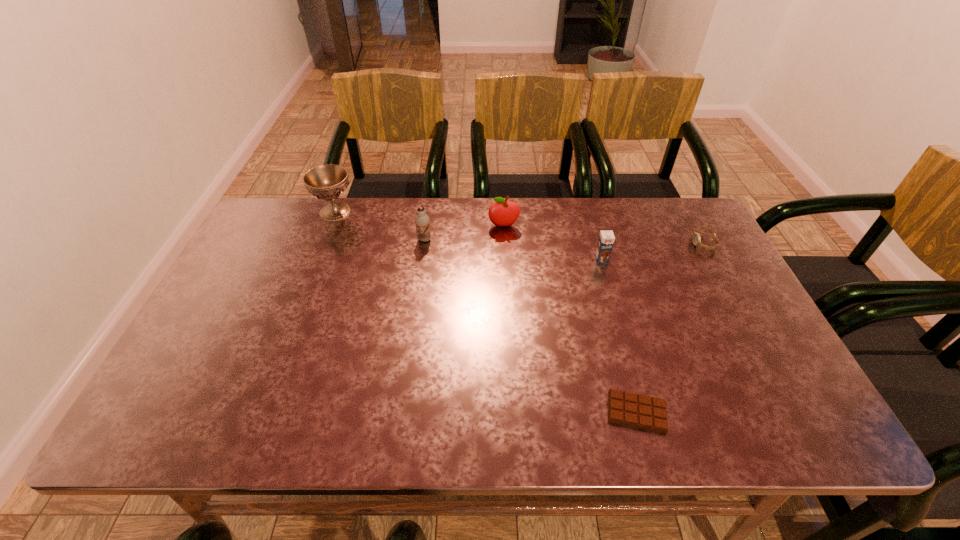
In order to click on chalice in this screenshot , I will do pos(327,182).

Locate an element on the screen. The image size is (960, 540). the fifth object from right to left is located at coordinates (422, 221).

What are the coordinates of `the farther chocolate milk` in the screenshot? It's located at (422, 221).

I want to click on the third object from left to right, so click(501, 213).

Where is `the right chocolate milk`? The height and width of the screenshot is (540, 960). the right chocolate milk is located at coordinates (606, 239).

You are a GUI agent. You are given a task and a screenshot of the screen. Output one action in this format:
    pyautogui.click(x=<x>, y=<y>)
    Task: Click on the nearer chocolate milk
    The height and width of the screenshot is (540, 960).
    Given the screenshot: What is the action you would take?
    pyautogui.click(x=606, y=239)

Locate an element on the screen. This screenshot has height=540, width=960. the fifth tallest object is located at coordinates (696, 236).

Image resolution: width=960 pixels, height=540 pixels. In order to click on the rightmost object in this screenshot , I will do `click(696, 236)`.

Where is `the nearest object`? the nearest object is located at coordinates (634, 410).

Identify the location of candy bar. This screenshot has height=540, width=960. (634, 410).